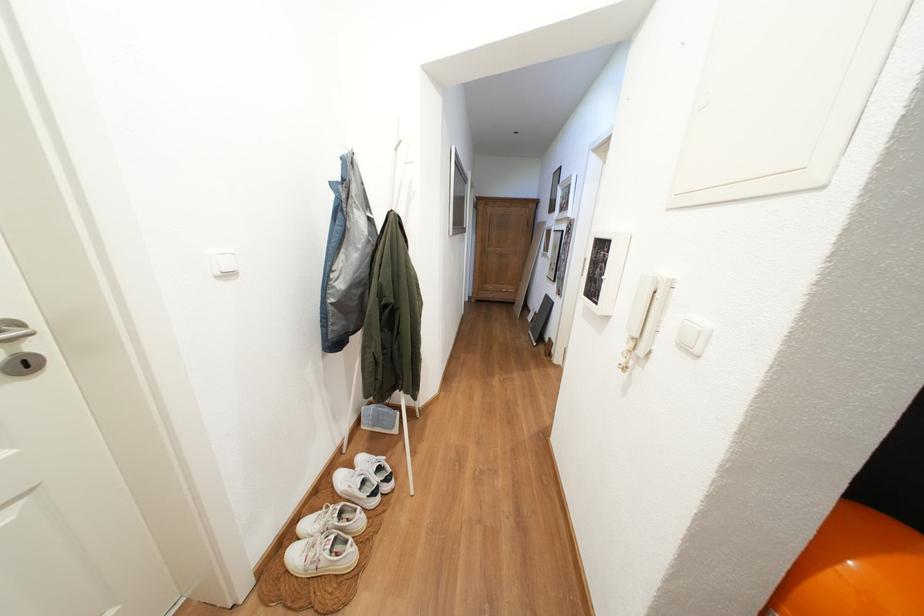
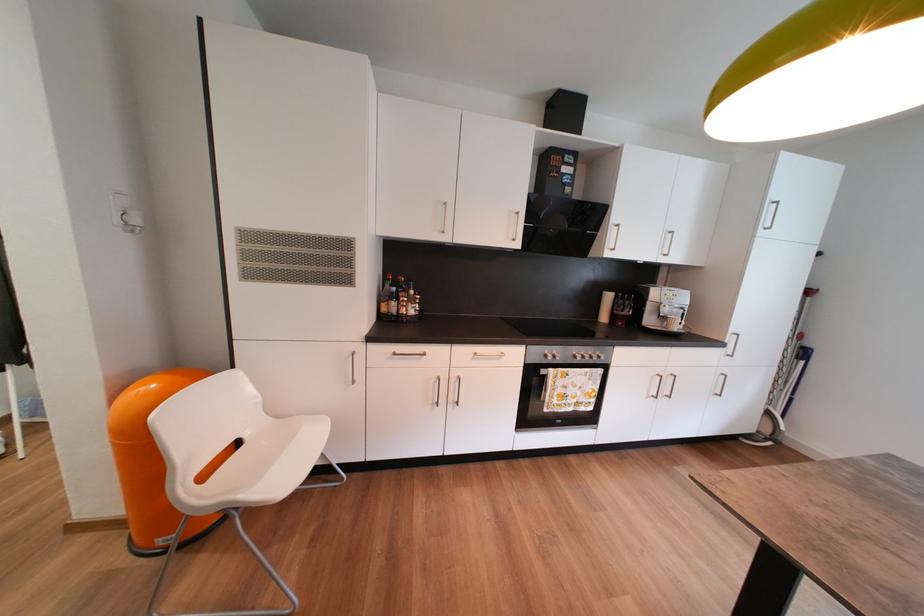
In a continuous first-person perspective shot, in which direction is the camera moving?

The movement direction of the cameraman is right, backward.